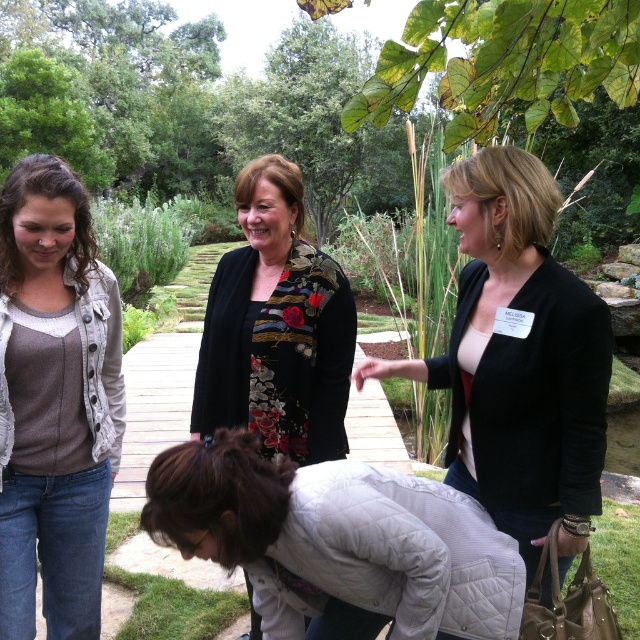
Question: Is black matte blazer at upper right wider than matte gray sweater at left?

Choices:
 (A) no
 (B) yes

Answer: (B)

Question: Is matte gray sweater at left smaller than floral-patterned fabric at center?

Choices:
 (A) yes
 (B) no

Answer: (A)

Question: Among these objects, which one is farthest from the camera?

Choices:
 (A) matte gray sweater at left
 (B) black matte blazer at upper right
 (C) floral-patterned fabric at center

Answer: (C)

Question: Which point appears closest to the camera in this image?

Choices:
 (A) (344, 429)
 (B) (488, 467)

Answer: (B)

Question: Which point is closer to the camera?

Choices:
 (A) black matte blazer at upper right
 (B) floral-patterned fabric at center

Answer: (A)

Question: Can you confirm if black matte blazer at upper right is positioned to the left of floral-patterned fabric at center?

Choices:
 (A) no
 (B) yes

Answer: (A)